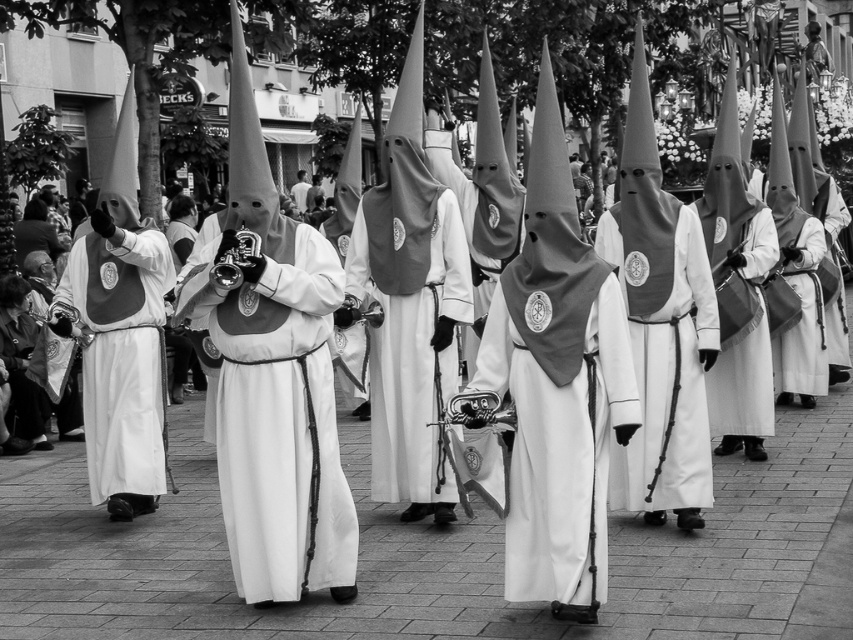
You are a photographer trying to capture a clear shot of the white matte uniform at center and the white fabric at center during the procession. Since both are white, you need to adjust your camera settings to distinguish them. Which object should you focus on first to ensure it appears sharp in the photo?

The white matte uniform at center is in front of the white fabric at center, so focusing on the white matte uniform at center first will ensure it appears sharp while the background fabric may blur slightly, creating depth.

You are a photographer standing in front of the procession. You want to take a photo that includes both the point at coordinates point (225, 307) and point (297, 195). Since you need to focus on the closest object, which point should you focus on?

Point (225, 307) is closer to the camera than point (297, 195), so you should focus on point (225, 307) to ensure the closest object is in focus.

You are a photographer standing at the camera position in the scene. You want to capture a closeup shot of the white matte vest at center. Given that your camera has a minimum focusing distance of 5 meters, can you successfully take the photo without moving closer?

The white matte vest at center is 10.44 meters away from the camera, which is beyond the minimum focusing distance of 5 meters. Therefore, you can successfully take the closeup shot without moving closer.